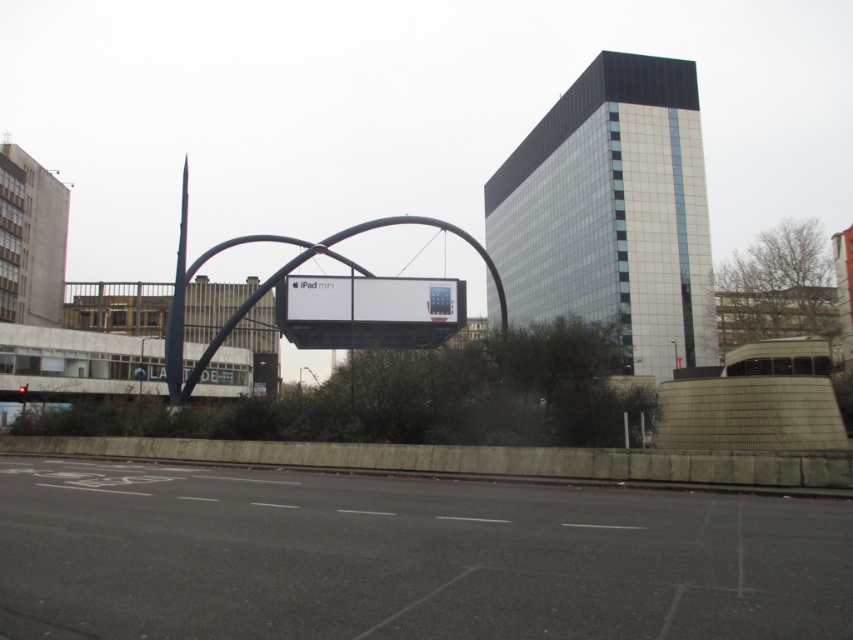
Question: Is white glossy ipad mini at center to the right of metallic archway at center from the viewer's perspective?

Choices:
 (A) no
 (B) yes

Answer: (B)

Question: Is white glossy ipad mini at center to the left of metallic archway at center from the viewer's perspective?

Choices:
 (A) no
 (B) yes

Answer: (A)

Question: Which point is farther from the camera taking this photo?

Choices:
 (A) (309, 310)
 (B) (245, 300)

Answer: (B)

Question: Which object is closer to the camera taking this photo?

Choices:
 (A) metallic archway at center
 (B) white glossy ipad mini at center

Answer: (A)

Question: Which point appears farthest from the camera in this image?

Choices:
 (A) (375, 300)
 (B) (349, 228)

Answer: (A)

Question: Is white glossy ipad mini at center smaller than metallic archway at center?

Choices:
 (A) yes
 (B) no

Answer: (A)